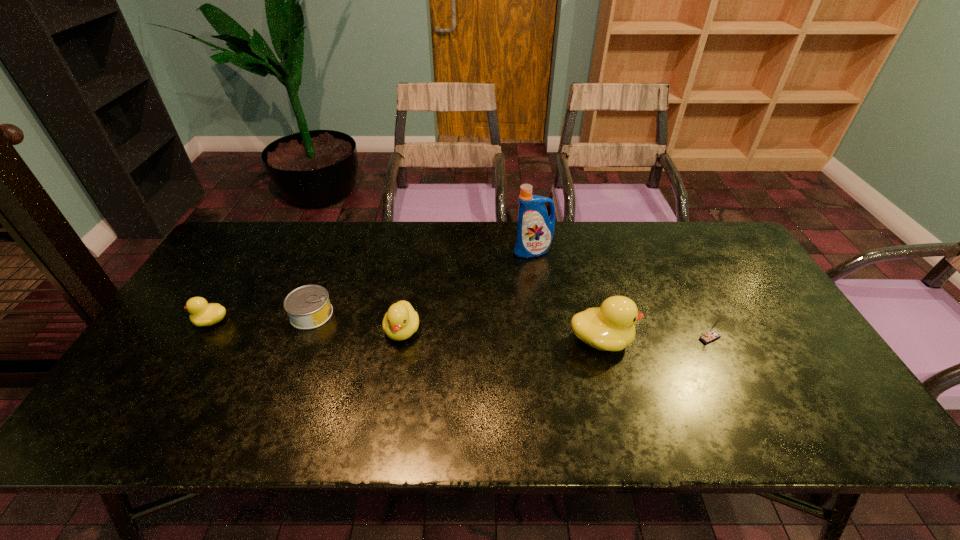
At what (x,y) coordinates should I click in order to perform the action: click on the leftmost duckling. Please return your answer as a coordinate pair (x, y). Looking at the image, I should click on (202, 313).

Where is `the shortest duckling`? the shortest duckling is located at coordinates (202, 313).

I want to click on the second shortest duckling, so (x=400, y=322).

In order to click on the second duckling from right to left in this screenshot , I will do `click(400, 322)`.

This screenshot has height=540, width=960. I want to click on the tallest duckling, so click(x=610, y=327).

Locate an element on the screen. This screenshot has height=540, width=960. the rightmost duckling is located at coordinates (610, 327).

I want to click on detergent, so click(x=535, y=230).

Find the location of a particular element. the farthest object is located at coordinates (535, 230).

Locate an element on the screen. The image size is (960, 540). the rightmost object is located at coordinates (712, 334).

The height and width of the screenshot is (540, 960). I want to click on the second object from left to right, so point(308,307).